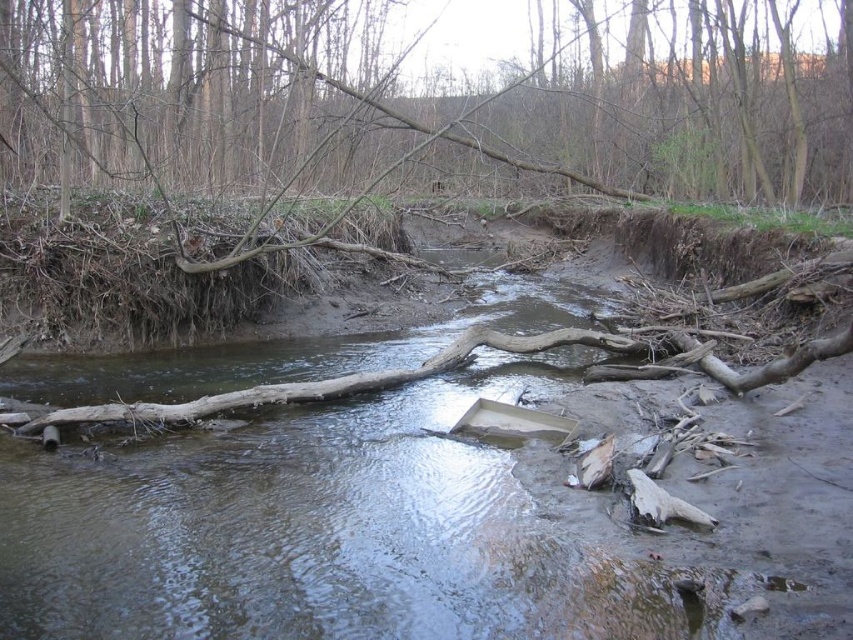
Question: Can you confirm if brown muddy river at center is positioned to the right of brown wood log at center?

Choices:
 (A) yes
 (B) no

Answer: (B)

Question: Can you confirm if brown muddy river at center is positioned above brown wood log at center?

Choices:
 (A) no
 (B) yes

Answer: (A)

Question: Which point is closer to the camera?

Choices:
 (A) (209, 611)
 (B) (74, 52)

Answer: (A)

Question: Which of the following is the farthest from the observer?

Choices:
 (A) brown muddy river at center
 (B) brown wood log at center

Answer: (B)

Question: Among these objects, which one is nearest to the camera?

Choices:
 (A) brown wood log at center
 (B) brown muddy river at center

Answer: (B)

Question: Is brown muddy river at center positioned in front of brown wood log at center?

Choices:
 (A) no
 (B) yes

Answer: (B)